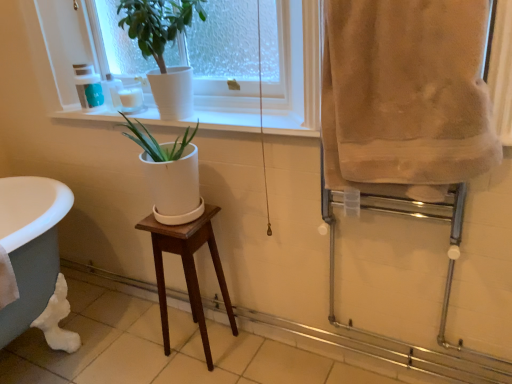
Question: Is mahogany wood stool at center not inside white ceramic at upper center?

Choices:
 (A) no
 (B) yes

Answer: (B)

Question: From the image's perspective, is mahogany wood stool at center on white ceramic at upper center?

Choices:
 (A) yes
 (B) no

Answer: (B)

Question: Does mahogany wood stool at center have a lesser height compared to white ceramic at upper center?

Choices:
 (A) no
 (B) yes

Answer: (A)

Question: Does mahogany wood stool at center have a greater width compared to white ceramic at upper center?

Choices:
 (A) no
 (B) yes

Answer: (B)

Question: Is mahogany wood stool at center positioned behind white ceramic at upper center?

Choices:
 (A) yes
 (B) no

Answer: (A)

Question: Is mahogany wood stool at center beside white ceramic at upper center?

Choices:
 (A) yes
 (B) no

Answer: (B)

Question: Is white ceramic pot at upper center positioned with its back to white ceramic at upper center?

Choices:
 (A) yes
 (B) no

Answer: (B)

Question: Considering the relative sizes of white ceramic pot at upper center and white ceramic at upper center in the image provided, is white ceramic pot at upper center wider than white ceramic at upper center?

Choices:
 (A) yes
 (B) no

Answer: (A)

Question: From the image's perspective, does white ceramic pot at upper center appear higher than white ceramic at upper center?

Choices:
 (A) yes
 (B) no

Answer: (A)

Question: Is white ceramic pot at upper center with white ceramic at upper center?

Choices:
 (A) yes
 (B) no

Answer: (B)

Question: Can you confirm if white ceramic pot at upper center is taller than white ceramic at upper center?

Choices:
 (A) no
 (B) yes

Answer: (B)

Question: Considering the relative positions of white ceramic pot at upper center and white ceramic at upper center in the image provided, is white ceramic pot at upper center in front of white ceramic at upper center?

Choices:
 (A) no
 (B) yes

Answer: (B)

Question: Is matte green plastic cup at upper left, placed as the 2th toiletry when sorted from right to left, located outside white ceramic pot at upper center?

Choices:
 (A) yes
 (B) no

Answer: (A)